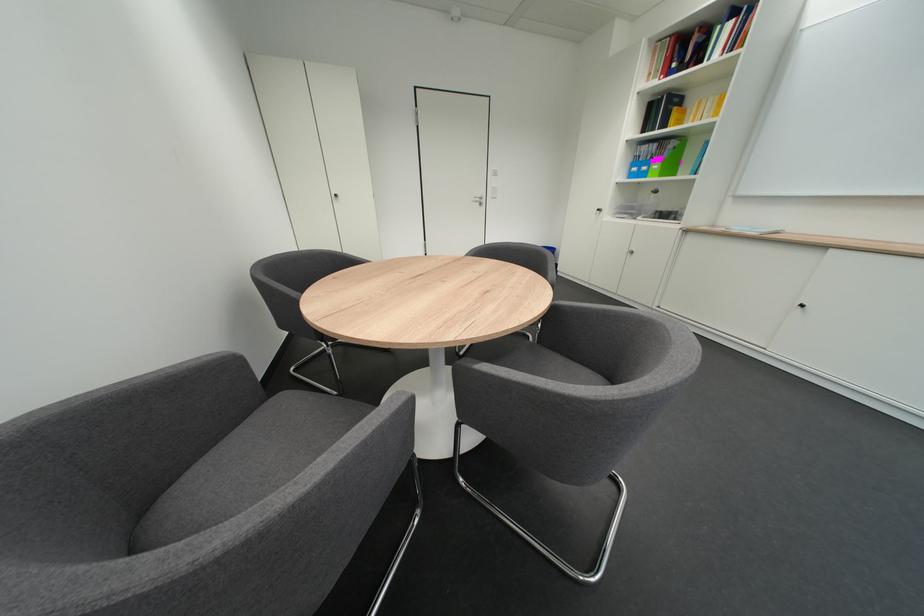
This screenshot has height=616, width=924. What are the coordinates of `yellow book` in the screenshot? It's located at (713, 122).